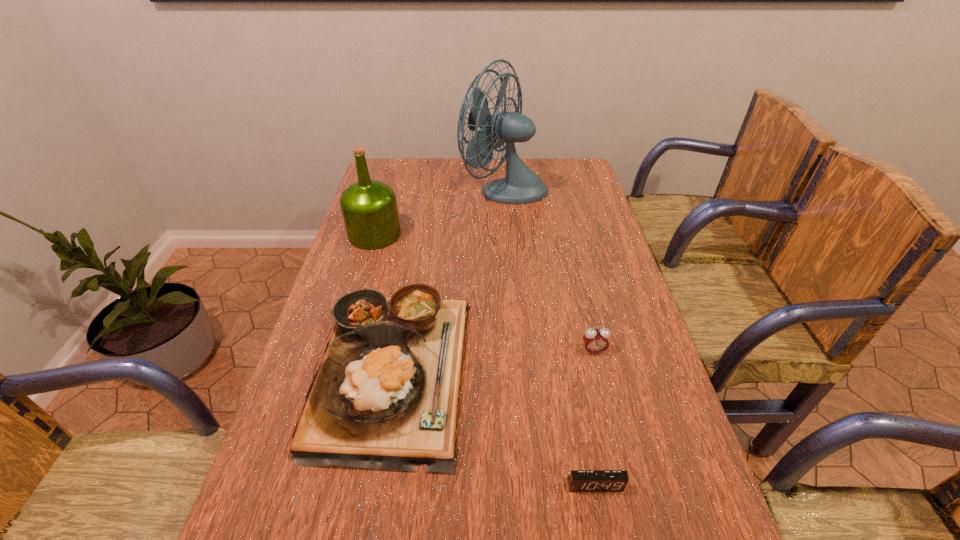
Find the location of `vacant point located 0.320m in front of the tallest object to blow air`. vacant point located 0.320m in front of the tallest object to blow air is located at coordinates (374, 188).

Where is `vacant space located 0.310m on the right of the second tallest object`? vacant space located 0.310m on the right of the second tallest object is located at coordinates coord(496,234).

This screenshot has width=960, height=540. Find the location of `free space located on the back of the platter`. free space located on the back of the platter is located at coordinates (414, 248).

This screenshot has height=540, width=960. Find the location of `vacant space situated 0.310m on the clock face of the farther alarm clock`. vacant space situated 0.310m on the clock face of the farther alarm clock is located at coordinates (626, 488).

Identify the location of vacant region located 0.060m on the front-facing side of the nearer alarm clock. The height and width of the screenshot is (540, 960). (603, 527).

Image resolution: width=960 pixels, height=540 pixels. What are the coordinates of `object positioned at the far edge` in the screenshot? It's located at (521, 185).

You are a GUI agent. You are given a task and a screenshot of the screen. Output one action in this format:
    pyautogui.click(x=<x>, y=<y>)
    Task: Click on the olive oil present at the left edge
    This screenshot has width=960, height=540.
    Given the screenshot: What is the action you would take?
    pyautogui.click(x=369, y=208)

This screenshot has width=960, height=540. What are the coordinates of `platter at the left edge` in the screenshot? It's located at (385, 396).

Where is `blank area at the far edge`? Image resolution: width=960 pixels, height=540 pixels. blank area at the far edge is located at coordinates (446, 166).

In the image, there is a desktop. At what (x,y) coordinates should I click in order to perform the action: click on vacant space at the left edge. Please return your answer as a coordinate pair (x, y). This screenshot has width=960, height=540. Looking at the image, I should click on (261, 489).